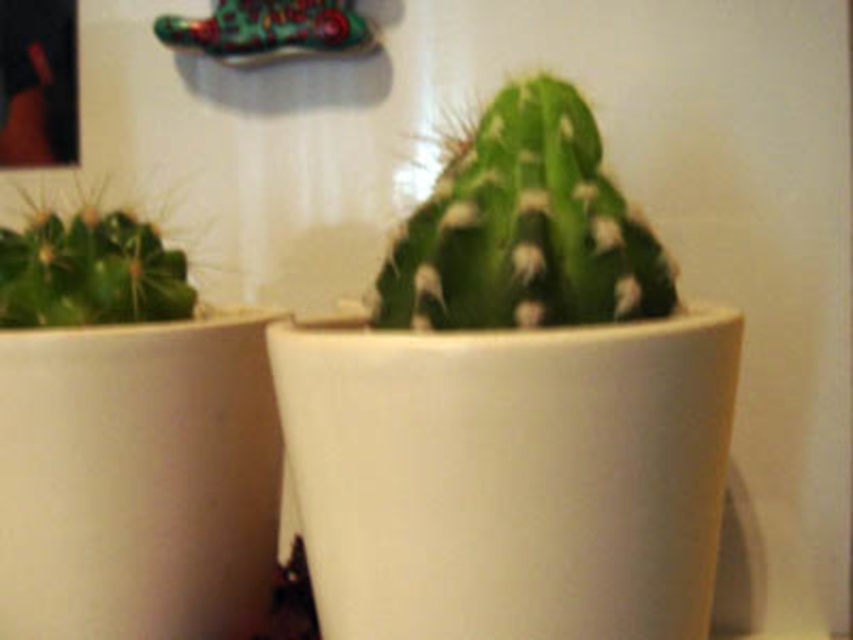
Is point (492, 269) positioned after point (45, 305)?

No.

Is green matte cactus at center taller than green matte cactus at left?

Yes.

Locate an element on the screen. green matte cactus at center is located at coordinates (524, 228).

The image size is (853, 640). What are the coordinates of `green matte cactus at center` in the screenshot? It's located at (524, 228).